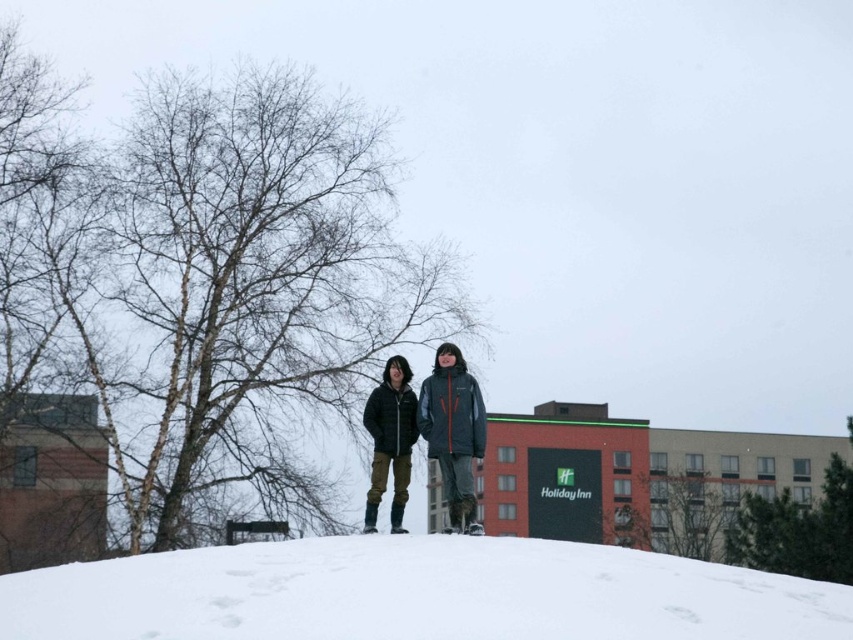
Question: Can you confirm if white fluffy snow at center is positioned above matte black jacket at center?

Choices:
 (A) yes
 (B) no

Answer: (B)

Question: Does white fluffy snow at center appear on the left side of matte black jacket at center?

Choices:
 (A) no
 (B) yes

Answer: (B)

Question: Does white fluffy snow at center have a greater width compared to matte black jacket at center?

Choices:
 (A) no
 (B) yes

Answer: (A)

Question: Which object appears closest to the camera in this image?

Choices:
 (A) matte black jacket at center
 (B) white fluffy snow at center

Answer: (B)